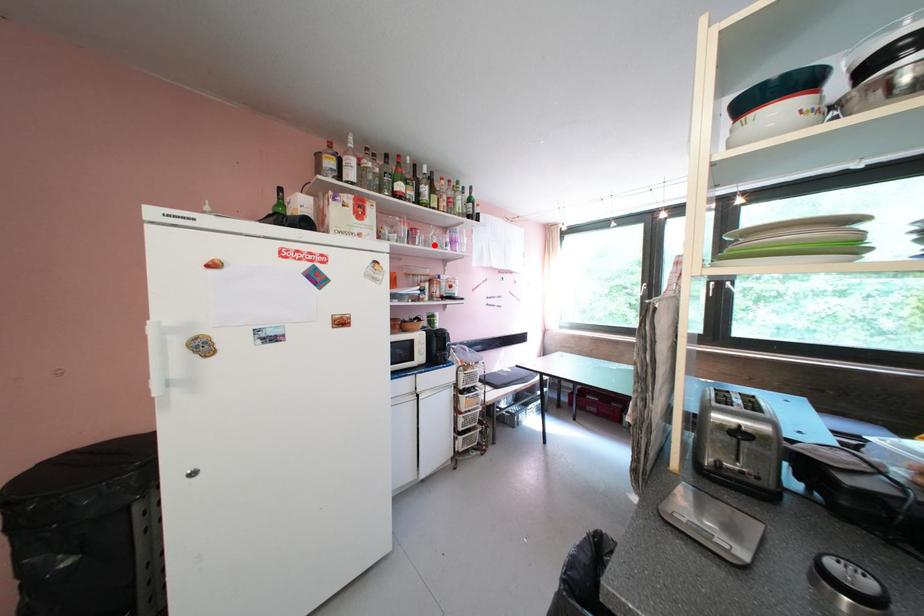
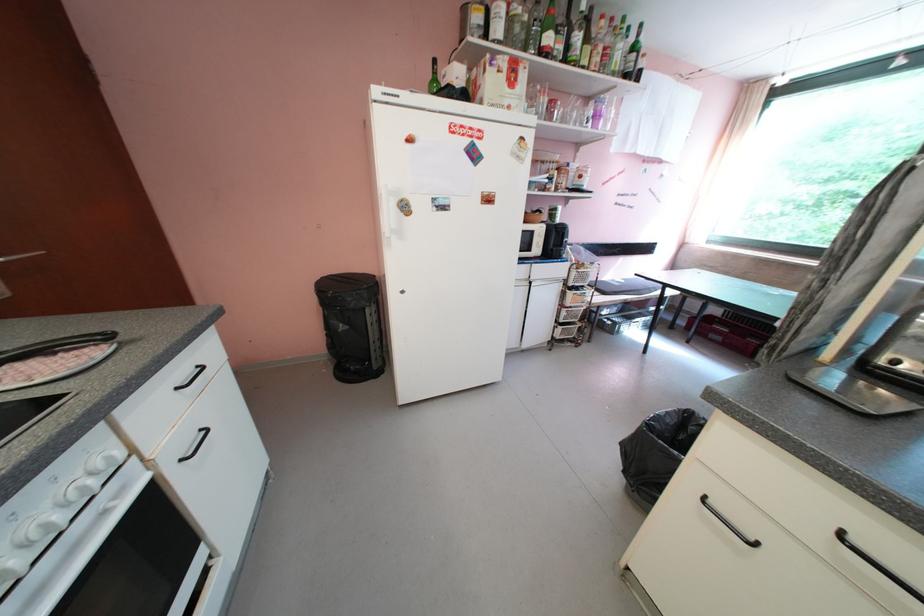
Where in the second image is the point corresponding to the highlighted location from the first image?

(572, 122)